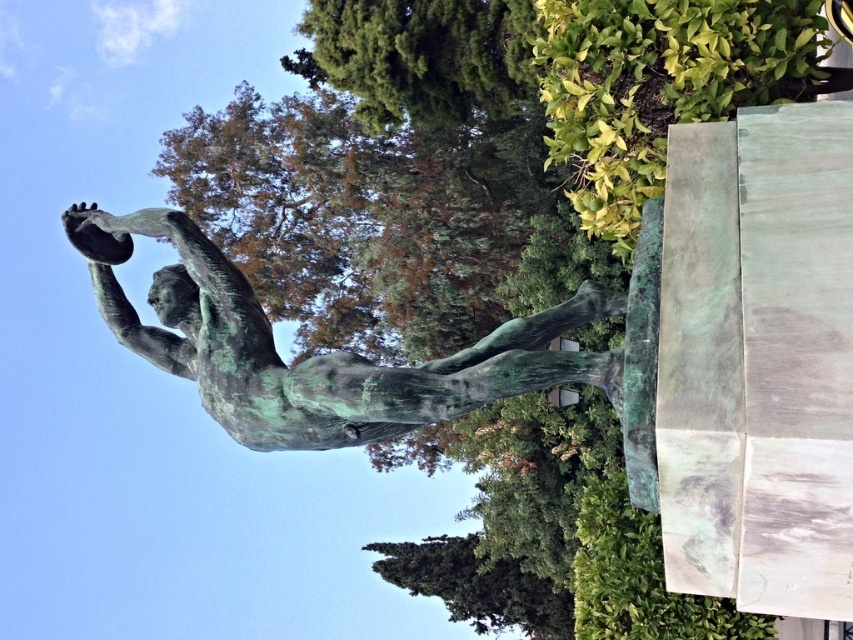
Question: Can you confirm if green leafy bush at upper right is positioned above green verdigris statue at lower center?

Choices:
 (A) yes
 (B) no

Answer: (A)

Question: Does green patina statue at center appear on the right side of green textured tree at upper center?

Choices:
 (A) no
 (B) yes

Answer: (A)

Question: Which object is positioned closest to the green leafy bush at upper right?

Choices:
 (A) green verdigris statue at lower center
 (B) green textured tree at upper center

Answer: (B)

Question: Which object appears closest to the camera in this image?

Choices:
 (A) green leafy bush at upper right
 (B) green patina statue at center
 (C) green textured tree at upper center
 (D) green verdigris statue at lower center

Answer: (B)

Question: From the image, what is the correct spatial relationship of green leafy bush at upper right in relation to green textured tree at upper center?

Choices:
 (A) left
 (B) right

Answer: (B)

Question: Which object is closer to the camera taking this photo?

Choices:
 (A) green patina statue at center
 (B) green leafy bush at upper right

Answer: (A)